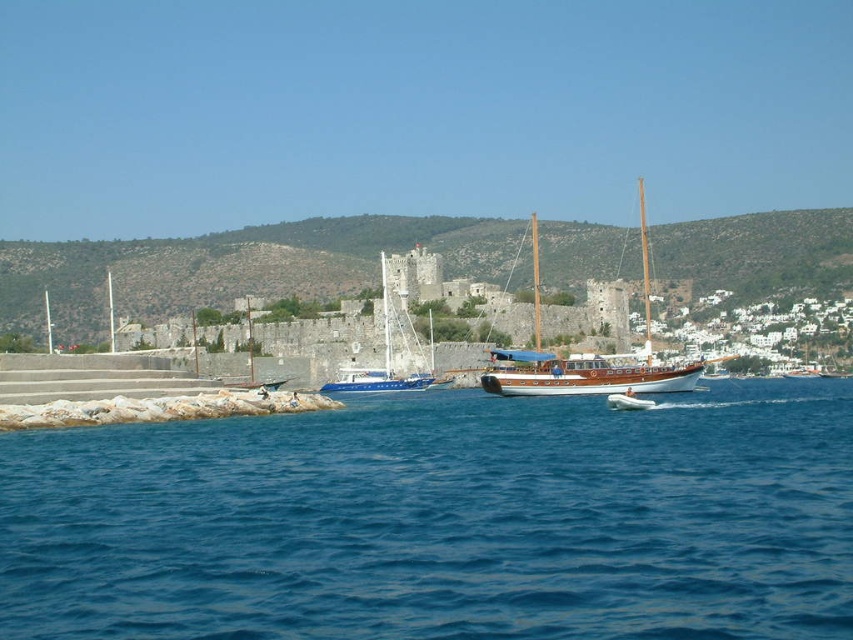
Is blue water at center closer to camera compared to wooden polished sailboat at center?

Yes.

Does blue water at center have a lesser height compared to wooden polished sailboat at center?

Yes, blue water at center is shorter than wooden polished sailboat at center.

Identify the location of blue water at center. The image size is (853, 640). (440, 520).

Does blue water at center appear over blue wooden sailboat at center?

No, blue water at center is not above blue wooden sailboat at center.

Between point (138, 620) and point (386, 268), which one is positioned behind?

The point (386, 268) is more distant.

Is point (70, 531) in front of point (384, 257)?

Yes, point (70, 531) is in front of point (384, 257).

Where is `blue water at center`? Image resolution: width=853 pixels, height=640 pixels. blue water at center is located at coordinates (440, 520).

Which of these two, wooden polished sailboat at center or blue wooden sailboat at center, stands shorter?

With less height is blue wooden sailboat at center.

Does wooden polished sailboat at center appear over blue wooden sailboat at center?

Yes.

Who is more distant from viewer, (515, 392) or (354, 381)?

Positioned behind is point (354, 381).

Locate an element on the screen. This screenshot has width=853, height=640. wooden polished sailboat at center is located at coordinates (592, 360).